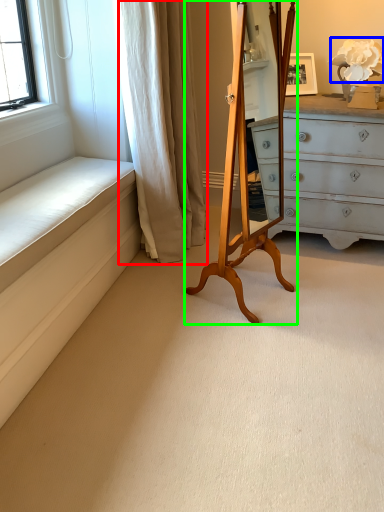
Question: Considering the real-world distances, which object is farthest from curtain (highlighted by a red box)? flower (highlighted by a blue box) or easel (highlighted by a green box)?

Choices:
 (A) flower
 (B) easel

Answer: (A)